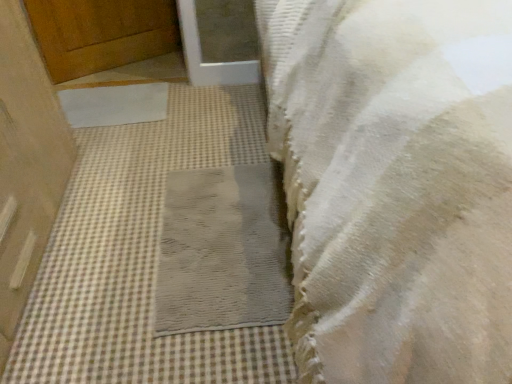
Locate an element on the screen. free space between wooden door at left, acting as the first door starting from the front, and gray textured mat at center, the first mat from the bottom is located at coordinates (114, 242).